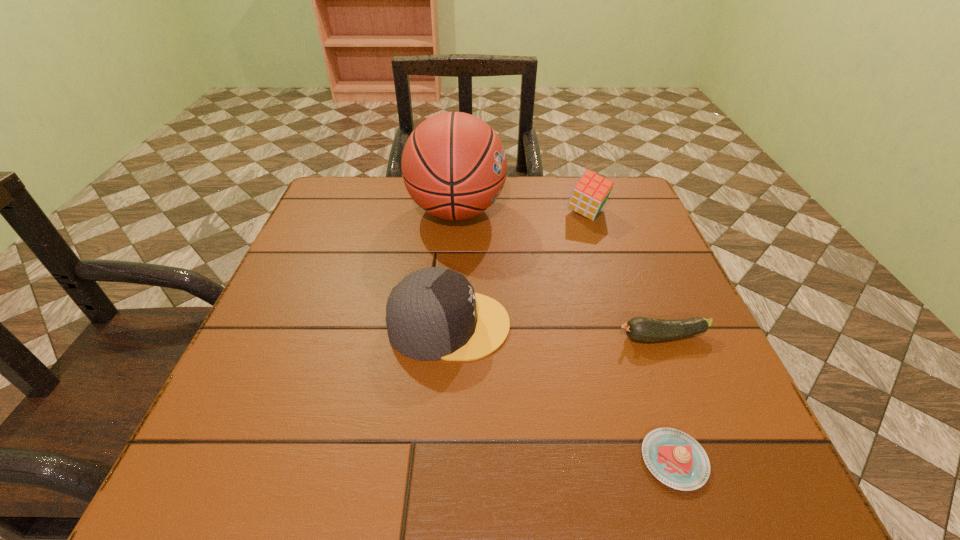
You are a GUI agent. You are given a task and a screenshot of the screen. Output one action in this format:
    pyautogui.click(x=<x>, y=<y>)
    Task: Click on the vacant area situated at the blossom end of the fourth tallest object
    The height and width of the screenshot is (540, 960).
    Given the screenshot: What is the action you would take?
    pyautogui.click(x=420, y=338)

Locate an element on the screen. Image resolution: width=960 pixels, height=540 pixels. vacant space situated at the blossom end of the fourth tallest object is located at coordinates (492, 338).

Locate an element on the screen. The height and width of the screenshot is (540, 960). vacant region located 0.290m on the left of the nearest object is located at coordinates (443, 460).

The image size is (960, 540). Find the location of `basketball located at the far edge`. basketball located at the far edge is located at coordinates pos(454,166).

The image size is (960, 540). Find the location of `cube that is at the far edge`. cube that is at the far edge is located at coordinates (589, 195).

Locate an element on the screen. The height and width of the screenshot is (540, 960). object located in the near edge section of the desktop is located at coordinates (675, 458).

Locate an element on the screen. cube that is at the right edge is located at coordinates (589, 195).

The width and height of the screenshot is (960, 540). In order to click on zucchini that is at the right edge in this screenshot , I will do point(642,329).

This screenshot has width=960, height=540. Find the location of `pastry at the right edge`. pastry at the right edge is located at coordinates (675, 458).

Locate an element on the screen. The height and width of the screenshot is (540, 960). object located in the far right corner section of the desktop is located at coordinates (589, 195).